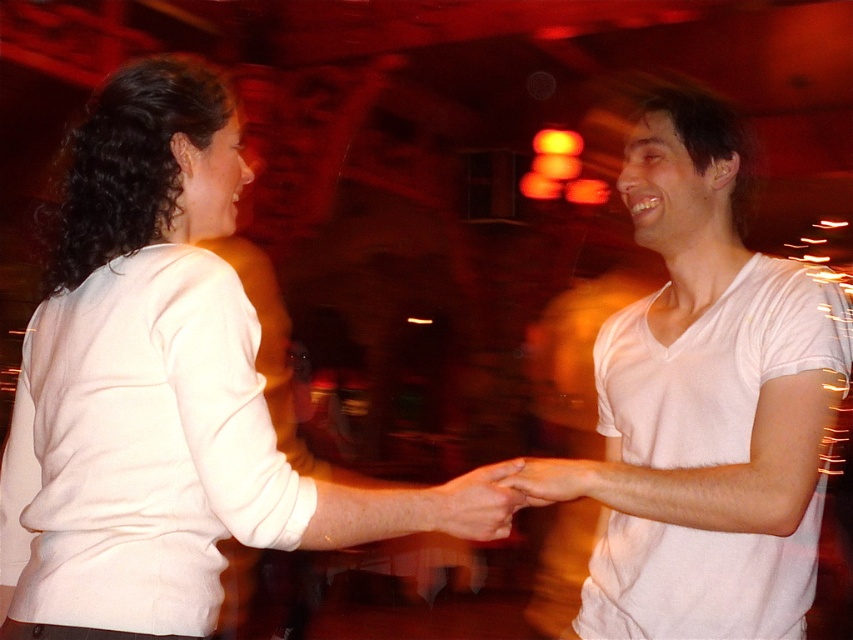
Between white matte shirt at center and smooth skin hand at center, which one has more height?

white matte shirt at center

Identify the location of white matte shirt at center. Image resolution: width=853 pixels, height=640 pixels. (152, 387).

Between white matte shirt at center and matte white hand at center, which one has more height?

With more height is white matte shirt at center.

Who is positioned more to the left, white matte shirt at center or matte white hand at center?

white matte shirt at center

Describe the element at coordinates (152, 387) in the screenshot. I see `white matte shirt at center` at that location.

Find the location of a particular element. white matte shirt at center is located at coordinates (152, 387).

Which of these two, white cotton shirt at right or matte white hand at center, stands taller?

white cotton shirt at right

What do you see at coordinates (706, 403) in the screenshot? I see `white cotton shirt at right` at bounding box center [706, 403].

In order to click on white cotton shirt at right in this screenshot , I will do `click(706, 403)`.